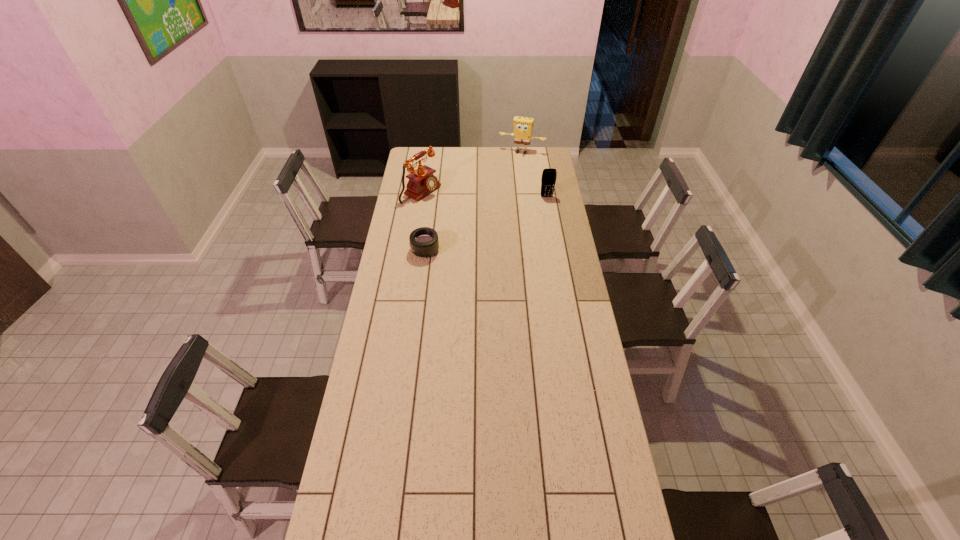
Find the location of a particular element. Image resolution: width=960 pixels, height=540 pixels. the shortest object is located at coordinates (424, 242).

Where is `the nearest object`? Image resolution: width=960 pixels, height=540 pixels. the nearest object is located at coordinates (424, 242).

Where is `the third tallest object`? the third tallest object is located at coordinates (548, 180).

Identify the location of the farthest object. (523, 126).

The image size is (960, 540). What are the coordinates of `telephone` in the screenshot? It's located at point(421,182).

Locate an element on the screen. The width and height of the screenshot is (960, 540). vacant space positioned 0.110m on the side of the nearest object with brand markings and control switches is located at coordinates (388, 250).

Image resolution: width=960 pixels, height=540 pixels. I want to click on vacant area situated on the screen of the third tallest object, so click(553, 232).

This screenshot has width=960, height=540. Identify the location of vacant space located 0.370m on the face of the sponge. (503, 190).

Locate an element on the screen. Image resolution: width=960 pixels, height=540 pixels. vacant space located 0.240m on the face of the sponge is located at coordinates [x=508, y=177].

The image size is (960, 540). Identify the location of free region located 0.160m on the face of the sponge. (511, 170).